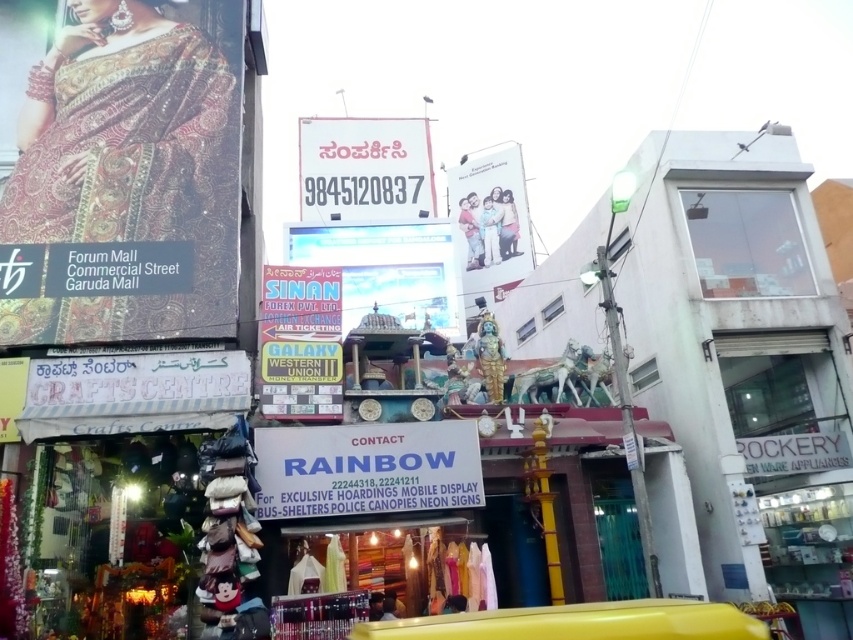
Question: Which point is farther to the camera?

Choices:
 (A) (465, 221)
 (B) (390, 276)
 (C) (294, 476)

Answer: (A)

Question: Is shiny silk saree at upper left above white paper sign at upper center?

Choices:
 (A) yes
 (B) no

Answer: (B)

Question: Is shiny silk saree at upper left bigger than white glossy family portrait at upper center?

Choices:
 (A) yes
 (B) no

Answer: (B)

Question: Does shiny silk saree at upper left appear under white glossy family portrait at upper center?

Choices:
 (A) no
 (B) yes

Answer: (B)

Question: Based on their relative distances, which object is nearer to the white glossy billboard at center?

Choices:
 (A) white glossy family portrait at upper center
 (B) shiny silk saree at upper left
 (C) white paper sign at upper center

Answer: (A)

Question: Based on their relative distances, which object is nearer to the shiny silk saree at upper left?

Choices:
 (A) white paper sign at upper center
 (B) white plastic signboard at center

Answer: (A)